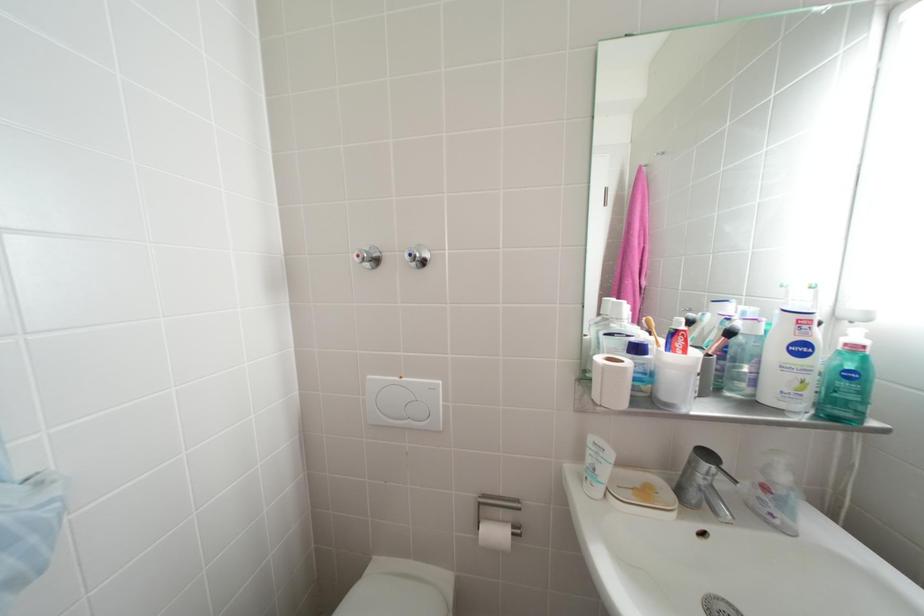
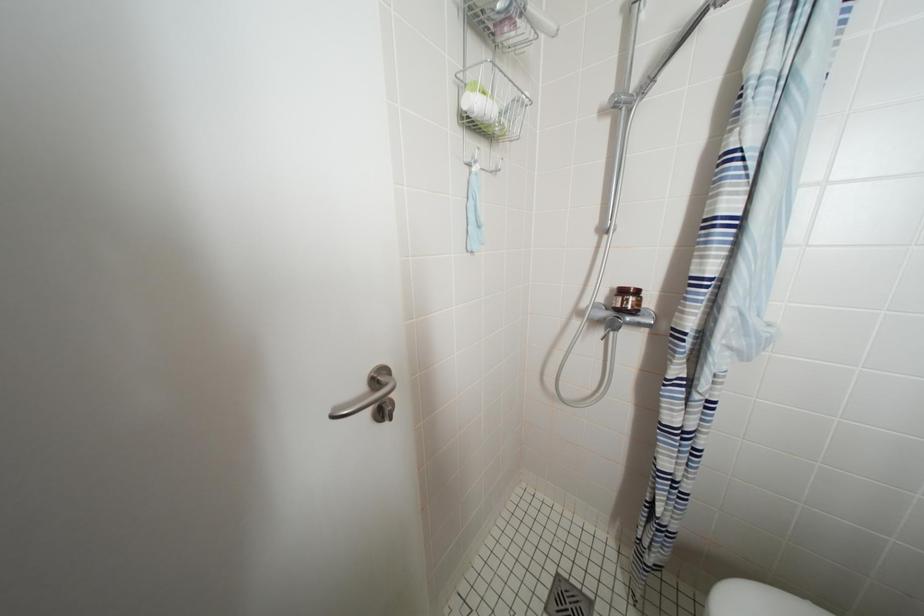
First-person continuous shooting, in which direction is the camera rotating?

The rotation direction of the camera is left-down.